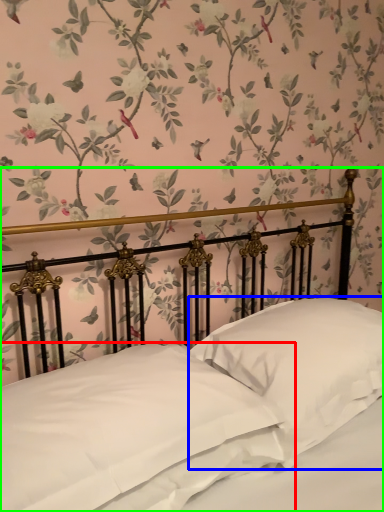
Question: Which is farther away from pillow (highlighted by a red box)? pillow (highlighted by a blue box) or bed (highlighted by a green box)?

Choices:
 (A) pillow
 (B) bed

Answer: (A)